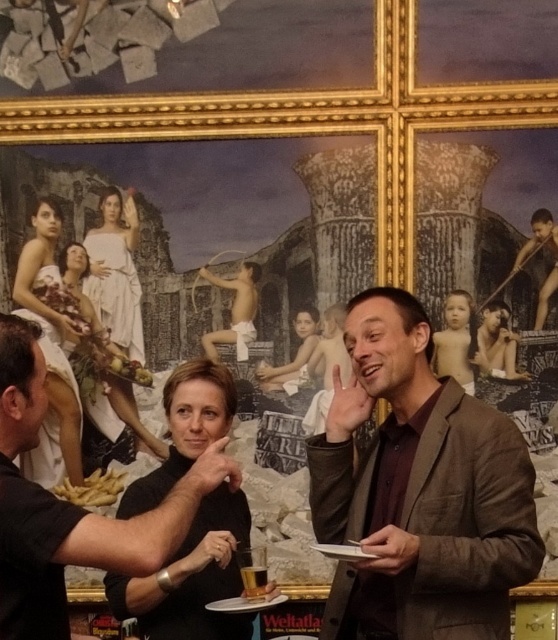
Does brown textured blazer at center appear on the right side of black matte shirt at center?

Correct, you'll find brown textured blazer at center to the right of black matte shirt at center.

Does brown textured blazer at center appear on the left side of black matte shirt at center?

In fact, brown textured blazer at center is to the right of black matte shirt at center.

Is point (501, 476) less distant than point (218, 451)?

That is True.

At what (x,y) coordinates should I click in order to perform the action: click on brown textured blazer at center. Please return your answer as a coordinate pair (x, y). This screenshot has width=558, height=640. Looking at the image, I should click on (418, 490).

Is white fabric dress at upper left wider than translucent glass beer at center?

Yes, white fabric dress at upper left is wider than translucent glass beer at center.

Who is shorter, white fabric dress at upper left or translucent glass beer at center?

translucent glass beer at center

Which is behind, point (102, 328) or point (259, 568)?

Point (102, 328)

Where is `white fabric dress at upper left`? white fabric dress at upper left is located at coordinates (68, 355).

Does brown textured blazer at center come behind white fabric dress at upper left?

No, brown textured blazer at center is closer to the viewer.

Is brown textured blazer at center bigger than white fabric dress at upper left?

Correct, brown textured blazer at center is larger in size than white fabric dress at upper left.

Describe the element at coordinates (418, 490) in the screenshot. I see `brown textured blazer at center` at that location.

Locate an element on the screen. This screenshot has height=640, width=558. brown textured blazer at center is located at coordinates (418, 490).